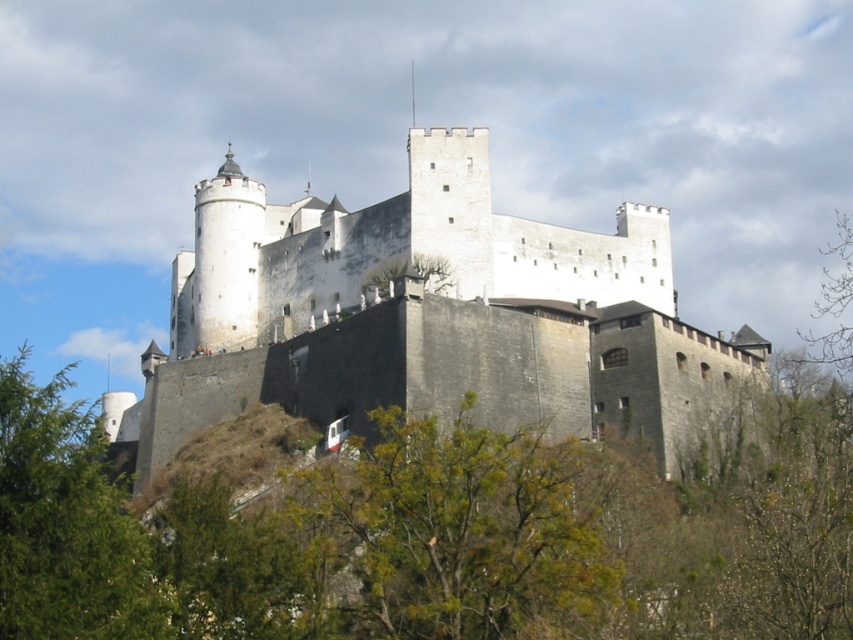
You are standing in a field looking at the white stone castle at center and the green leafy tree at lower center. Which object is closer to you?

The green leafy tree at lower center is closer to you because the white stone castle at center is further away.

You are standing at the base of the castle hill and see the green leafy tree at lower center and the green leafy tree at lower left. Which tree is closer to the castle?

The green leafy tree at lower center is located below the green leafy tree at lower left, meaning it is closer to the castle since it is positioned lower in the image.